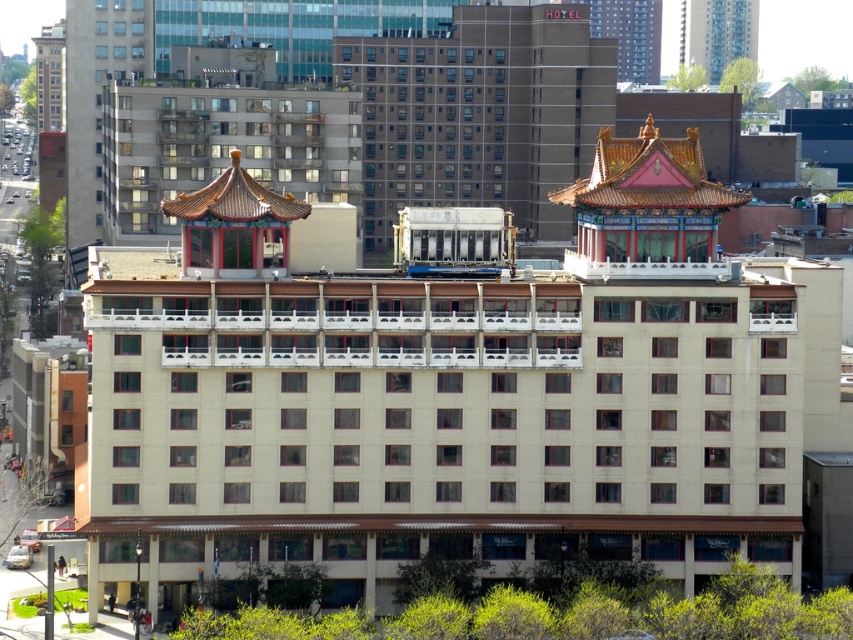
You are an architect evaluating two buildings in the city. You see the white matte building at center and the beige concrete hotel at center. Which one has a larger overall size?

The white matte building at center is bigger than the beige concrete hotel at center, so the white matte building at center has a larger overall size.

You are standing in front of the building and want to walk from the point at coordinates point (440, 522) to the point at coordinates point (567, 157). Which direction should you move relative to the building?

You should move towards the left and forward relative to the building because point (440, 522) is in front of point (567, 157).

You are standing on the sidewalk in front of the white matte building at center. Your friend is on the 10th floor, which is 100 meters away from you. Can you see your friend waving from your current position?

The distance between you and the white matte building at center is 110.49 meters, which is greater than the 100 meters to the 10th floor. Therefore, you cannot see your friend waving from your current position because they are closer to you than the building itself.